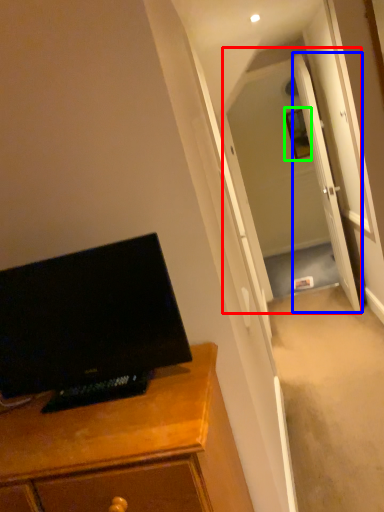
Question: Considering the real-world distances, which object is closest to glass door (highlighted by a red box)? door (highlighted by a blue box) or picture frame (highlighted by a green box).

Choices:
 (A) door
 (B) picture frame

Answer: (A)